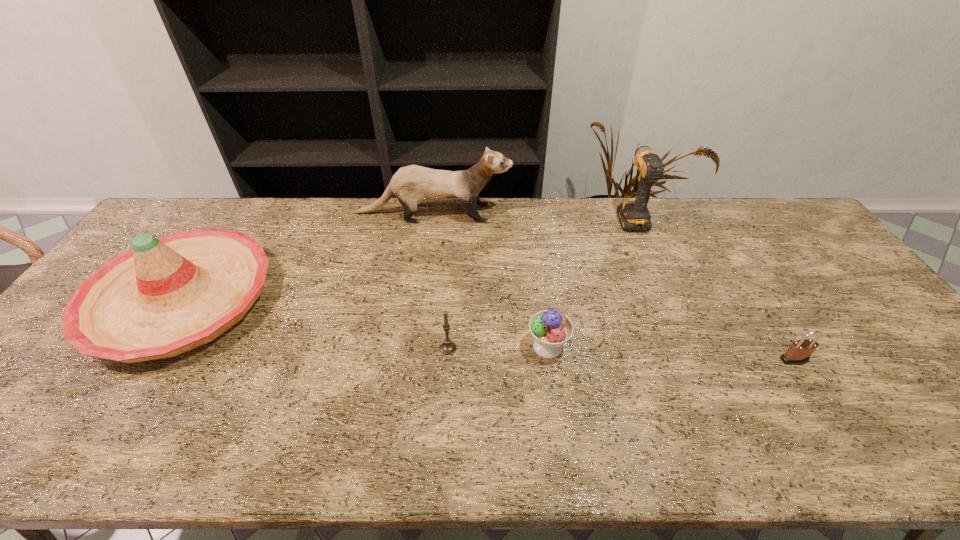
This screenshot has width=960, height=540. In order to click on vacant area situated on the left of the third object from right to left in this screenshot , I will do `click(401, 347)`.

This screenshot has height=540, width=960. Find the location of `free region located 0.180m on the front of the shortest object`. free region located 0.180m on the front of the shortest object is located at coordinates (840, 435).

Locate an element on the screen. The width and height of the screenshot is (960, 540). drill positioned at the far edge is located at coordinates (634, 215).

Identify the location of ferret at the far edge. (412, 185).

Find the location of a particular element. This screenshot has width=960, height=540. object present at the left edge is located at coordinates (166, 296).

Where is `vacant space at the far edge of the desktop`? This screenshot has width=960, height=540. vacant space at the far edge of the desktop is located at coordinates (638, 236).

In the image, there is a desktop. At what (x,y) coordinates should I click in order to perform the action: click on vacant space at the near edge. Please return your answer as a coordinate pair (x, y). Looking at the image, I should click on (423, 454).

This screenshot has width=960, height=540. In the image, there is a desktop. In order to click on vacant space at the left edge in this screenshot , I will do 25,418.

In the image, there is a desktop. At what (x,y) coordinates should I click in order to perform the action: click on vacant space at the right edge. Please return your answer as a coordinate pair (x, y). Image resolution: width=960 pixels, height=540 pixels. Looking at the image, I should click on (833, 306).

Identify the location of free space at the far left corner of the desktop. Image resolution: width=960 pixels, height=540 pixels. (204, 219).